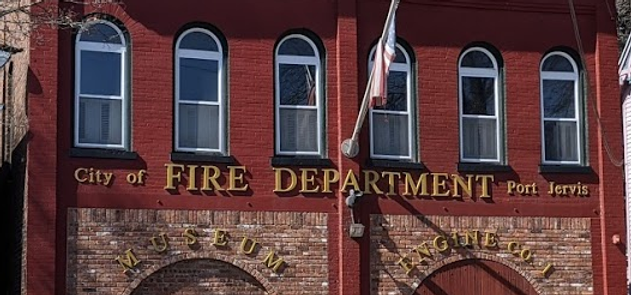
Find the location of a particular element. brown brick wall is located at coordinates (314, 246), (410, 230).